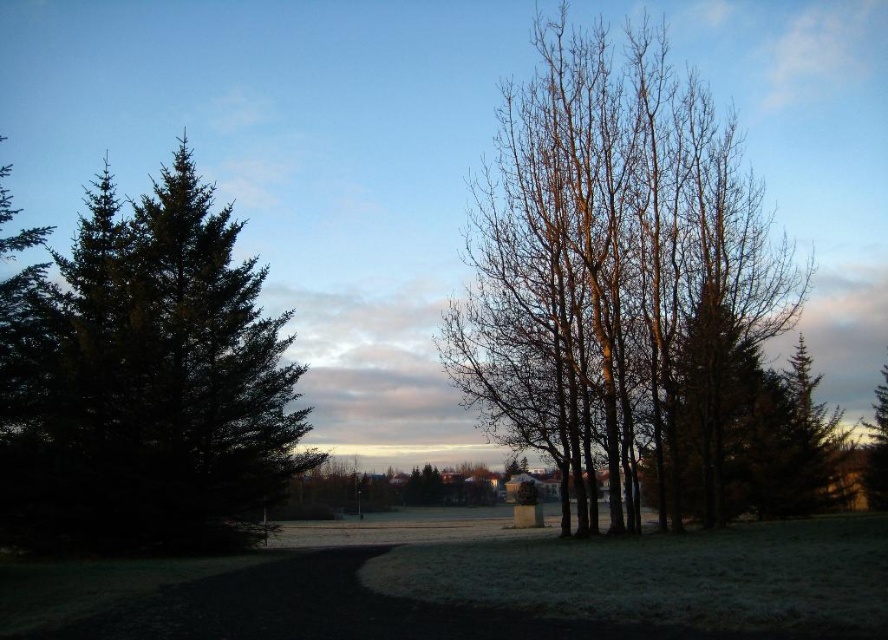
You are standing in the frosty grassy area and want to walk towards the green matte tree at left. Which direction should you go relative to the bare branches at center?

You should go to the left of the bare branches at center because the green matte tree at left is positioned to the left of the bare branches at center.

You are standing in the serene outdoor scene depicted in the image. You notice two points marked at coordinates point (x=716, y=483) and point (x=258, y=506). If you want to reach the point closer to you first, which coordinate should you head towards?

You should head towards point (x=258, y=506) because it is closer to you than point (x=716, y=483), which is further away.